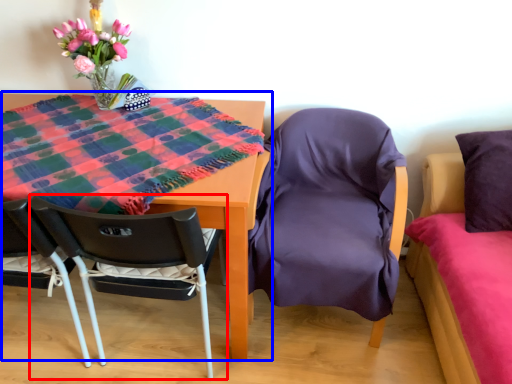
Question: Which object is closer to the camera taking this photo, chair (highlighted by a red box) or table (highlighted by a blue box)?

Choices:
 (A) chair
 (B) table

Answer: (B)